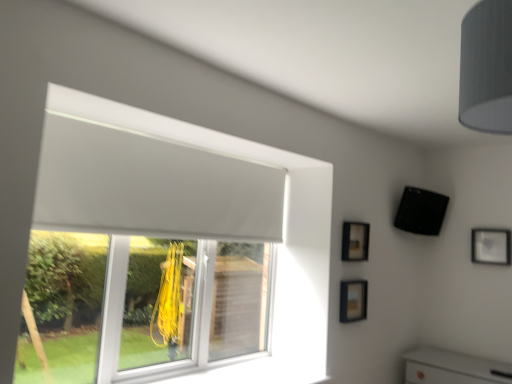
Question: Considering the relative sizes of gray fabric lampshade at upper right and matte black picture frame at upper right, positioned as the 1th picture frame in back-to-front order, in the image provided, is gray fabric lampshade at upper right taller than matte black picture frame at upper right, positioned as the 1th picture frame in back-to-front order,?

Choices:
 (A) yes
 (B) no

Answer: (A)

Question: Considering the relative sizes of gray fabric lampshade at upper right and matte black picture frame at upper right, positioned as the third picture frame in front-to-back order, in the image provided, is gray fabric lampshade at upper right shorter than matte black picture frame at upper right, positioned as the third picture frame in front-to-back order,?

Choices:
 (A) yes
 (B) no

Answer: (B)

Question: Does gray fabric lampshade at upper right have a smaller size compared to matte black picture frame at upper right, positioned as the 1th picture frame in back-to-front order?

Choices:
 (A) no
 (B) yes

Answer: (A)

Question: From the image's perspective, would you say gray fabric lampshade at upper right is positioned over matte black picture frame at upper right, positioned as the 1th picture frame in back-to-front order?

Choices:
 (A) no
 (B) yes

Answer: (B)

Question: Can you confirm if gray fabric lampshade at upper right is positioned to the left of matte black picture frame at upper right, positioned as the 1th picture frame in right-to-left order?

Choices:
 (A) yes
 (B) no

Answer: (A)

Question: From a real-world perspective, is white matte window at upper left physically located above or below matte black picture frame at upper right, positioned as the 1th picture frame in back-to-front order?

Choices:
 (A) above
 (B) below

Answer: (B)

Question: Looking at the image, does white matte window at upper left seem bigger or smaller compared to matte black picture frame at upper right, positioned as the third picture frame in left-to-right order?

Choices:
 (A) big
 (B) small

Answer: (A)

Question: Is point (80, 152) closer or farther from the camera than point (493, 261)?

Choices:
 (A) closer
 (B) farther

Answer: (A)

Question: Considering the positions of white matte window at upper left and matte black picture frame at upper right, positioned as the 1th picture frame in right-to-left order, in the image, is white matte window at upper left taller or shorter than matte black picture frame at upper right, positioned as the 1th picture frame in right-to-left order,?

Choices:
 (A) short
 (B) tall

Answer: (B)

Question: In the image, is matte black picture frame at upper right, positioned as the third picture frame in left-to-right order, positioned in front of or behind white matte window at upper left?

Choices:
 (A) behind
 (B) front

Answer: (A)

Question: Is matte black picture frame at upper right, positioned as the third picture frame in left-to-right order, inside or outside of white matte window at upper left?

Choices:
 (A) outside
 (B) inside

Answer: (A)

Question: Is matte black picture frame at upper right, positioned as the third picture frame in left-to-right order, to the left or to the right of white matte window at upper left in the image?

Choices:
 (A) left
 (B) right

Answer: (B)

Question: From the image's perspective, is matte black picture frame at upper right, positioned as the third picture frame in left-to-right order, positioned above or below white matte window at upper left?

Choices:
 (A) above
 (B) below

Answer: (B)

Question: From the image's perspective, is white matte window at upper left located above or below gray fabric lampshade at upper right?

Choices:
 (A) below
 (B) above

Answer: (A)

Question: In terms of height, does white matte window at upper left look taller or shorter compared to gray fabric lampshade at upper right?

Choices:
 (A) tall
 (B) short

Answer: (A)